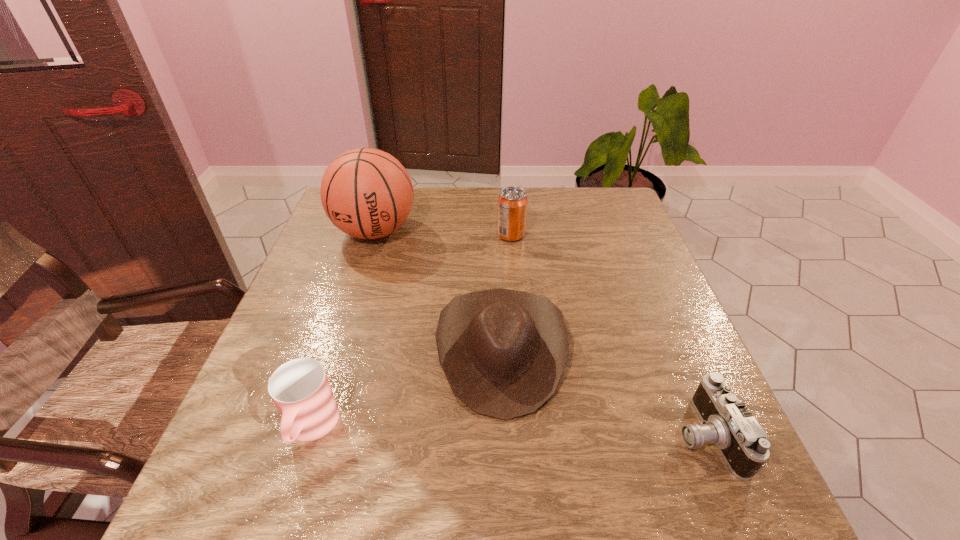
This screenshot has width=960, height=540. I want to click on object that is at the near right corner, so click(726, 422).

Image resolution: width=960 pixels, height=540 pixels. Identify the location of blank space at the far edge. (450, 211).

The width and height of the screenshot is (960, 540). In the image, there is a desktop. What are the coordinates of `vacant space at the near edge` in the screenshot? It's located at (540, 491).

Locate an element on the screen. vacant point at the left edge is located at coordinates (243, 428).

Where is `free space at the right edge of the desktop`? This screenshot has width=960, height=540. free space at the right edge of the desktop is located at coordinates (660, 292).

Locate an element on the screen. The image size is (960, 540). vacant space at the far left corner of the desktop is located at coordinates 325,220.

Find the location of a particular element. free space at the near left corner of the desktop is located at coordinates (209, 485).

The height and width of the screenshot is (540, 960). In order to click on free area in between the cowboy hat and the basketball in this screenshot , I will do `click(438, 291)`.

The width and height of the screenshot is (960, 540). Identify the location of vacant space in between the basketball and the cup. (343, 330).

The image size is (960, 540). I want to click on vacant point located between the cup and the soda can, so click(x=411, y=332).